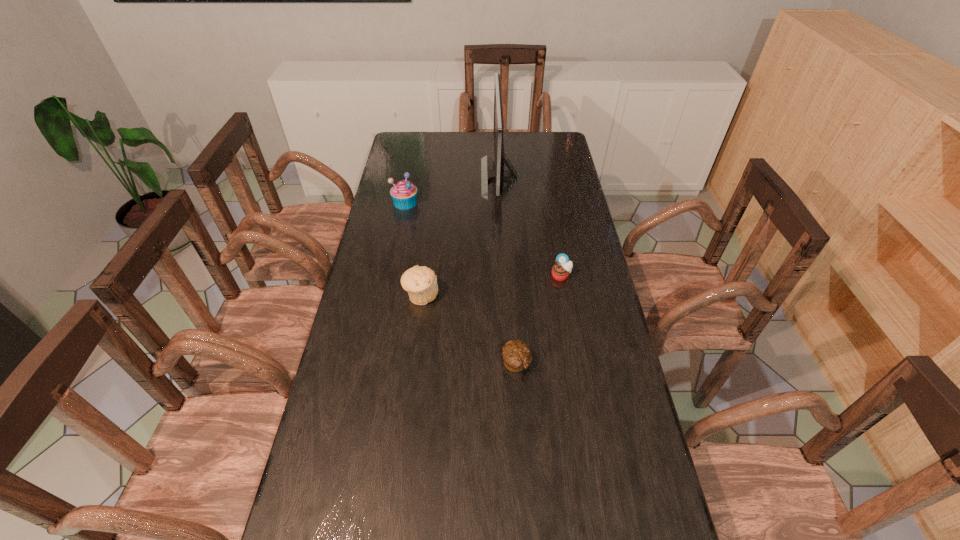
You are a GUI agent. You are given a task and a screenshot of the screen. Output one action in this format:
    pyautogui.click(x=<x>, y=<y>)
    Task: Click on the tallest object
    Image resolution: width=960 pixels, height=540 pixels.
    Given the screenshot: What is the action you would take?
    pyautogui.click(x=499, y=174)

At what (x,y) coordinates should I click in order to perform the action: click on the farthest muffin. Please return your answer as a coordinate pair (x, y). The width and height of the screenshot is (960, 540). Looking at the image, I should click on (404, 194).

Where is `the second nearest object`? the second nearest object is located at coordinates (420, 282).

Find the location of `the second shortest muffin`. the second shortest muffin is located at coordinates (560, 271).

What are the coordinates of `the rightmost object` in the screenshot? It's located at (560, 271).

This screenshot has width=960, height=540. I want to click on the nearest muffin, so click(517, 355).

Where is `the shortest object`? The width and height of the screenshot is (960, 540). the shortest object is located at coordinates (517, 355).

You are a GUI agent. You are given a task and a screenshot of the screen. Output one action in this format:
    pyautogui.click(x=<x>, y=<y>)
    Task: Click on the blank space located on the screen side of the tallest object
    The width and height of the screenshot is (960, 540).
    Given the screenshot: What is the action you would take?
    pyautogui.click(x=428, y=177)

Locate an element on the screen. vacant point located 0.080m on the screen side of the tallest object is located at coordinates (462, 177).

The width and height of the screenshot is (960, 540). In order to click on vacant space located 0.380m on the screen side of the tallest object in this screenshot , I will do `click(389, 177)`.